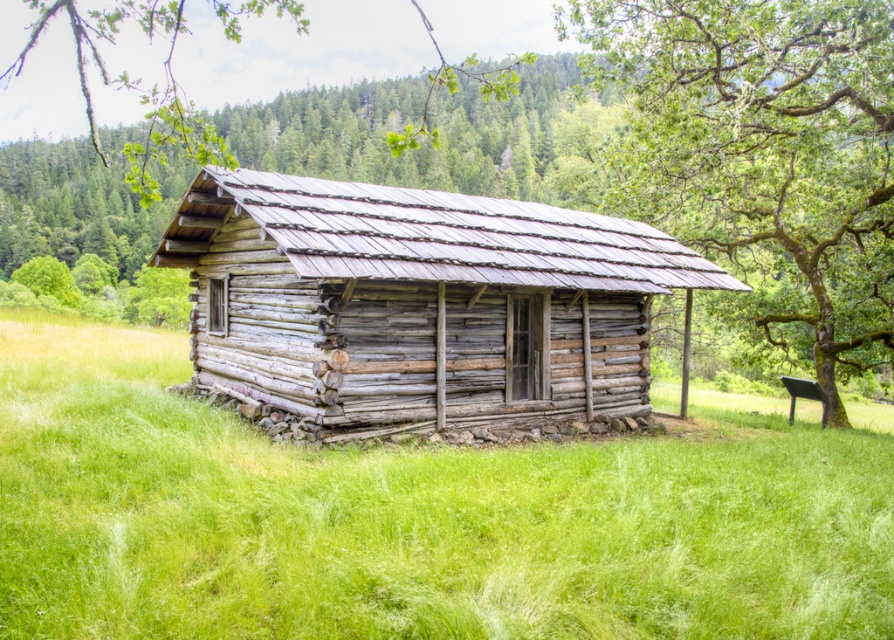
Where is `green leafy tree at upper center`? The image size is (894, 640). green leafy tree at upper center is located at coordinates (414, 300).

Can you confirm if green leafy tree at upper center is shorter than weathered wood cabin at center?

In fact, green leafy tree at upper center may be taller than weathered wood cabin at center.

What do you see at coordinates (414, 300) in the screenshot? Image resolution: width=894 pixels, height=640 pixels. I see `green leafy tree at upper center` at bounding box center [414, 300].

The width and height of the screenshot is (894, 640). Identify the location of green leafy tree at upper center. (414, 300).

Can you confirm if green grassy field at center is wider than green mossy bark tree at upper right?

Indeed, green grassy field at center has a greater width compared to green mossy bark tree at upper right.

The width and height of the screenshot is (894, 640). Describe the element at coordinates (411, 518) in the screenshot. I see `green grassy field at center` at that location.

Measure the distance between point (56, 385) and camera.

Point (56, 385) is 10.84 meters from camera.

Where is `green grassy field at center`? The image size is (894, 640). green grassy field at center is located at coordinates (411, 518).

Is green leafy tree at upper center smaller than green mossy bark tree at upper right?

Actually, green leafy tree at upper center might be larger than green mossy bark tree at upper right.

Does green leafy tree at upper center have a lesser width compared to green mossy bark tree at upper right?

No, green leafy tree at upper center is not thinner than green mossy bark tree at upper right.

Who is more distant from viewer, (280, 339) or (638, 156)?

The point (638, 156) is more distant.

The image size is (894, 640). In order to click on green leafy tree at upper center in this screenshot , I will do `click(414, 300)`.